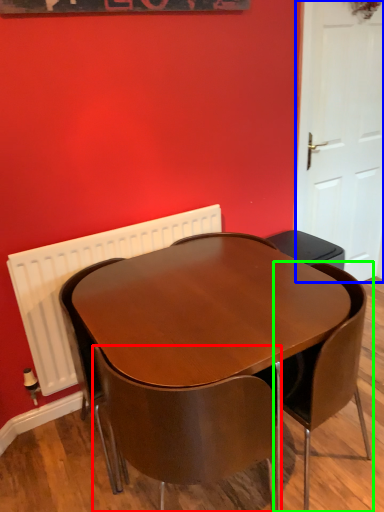
Question: Considering the real-world distances, which object is farthest from chair (highlighted by a red box)? door (highlighted by a blue box) or chair (highlighted by a green box)?

Choices:
 (A) door
 (B) chair

Answer: (A)